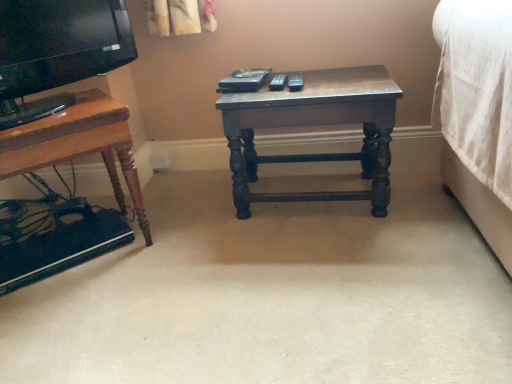
Where is `free space underneath dark wood table at center, the 2th table when ordered from left to right (from a real-world perspective)`? free space underneath dark wood table at center, the 2th table when ordered from left to right (from a real-world perspective) is located at coordinates (314, 196).